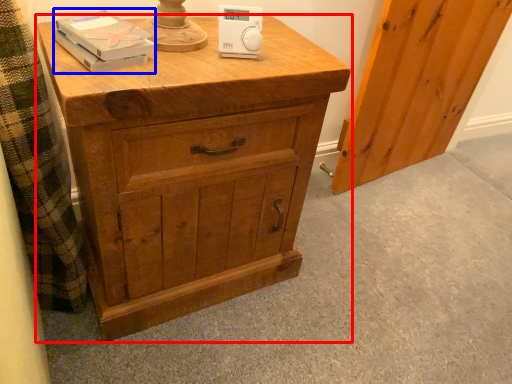
Question: Which point is further to the camera, chest of drawers (highlighted by a red box) or book (highlighted by a blue box)?

Choices:
 (A) chest of drawers
 (B) book

Answer: (B)